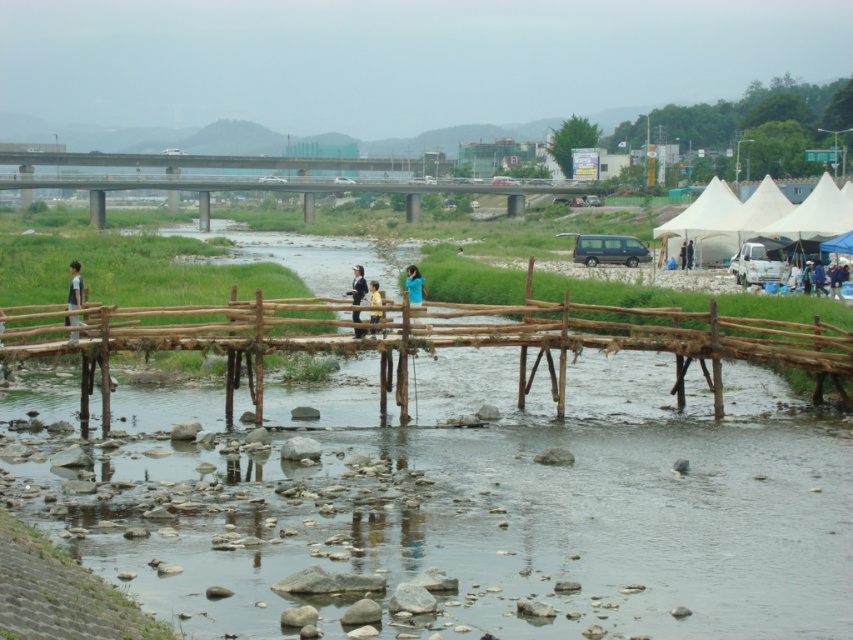
Question: Which of these objects is positioned farthest from the natural wood bridge at center?

Choices:
 (A) yellow shirt at center
 (B) wooden fence at center
 (C) light blue fabric jacket at center
 (D) blue fabric at center

Answer: (B)

Question: Which point is farther to the camera?

Choices:
 (A) blue fabric at center
 (B) light blue fabric jacket at center

Answer: (A)

Question: Can you confirm if light blue shirt at left is positioned above light blue fabric jacket at center?

Choices:
 (A) no
 (B) yes

Answer: (B)

Question: Which point appears farthest from the camera in this image?

Choices:
 (A) (184, 342)
 (B) (380, 294)
 (C) (70, 333)

Answer: (B)

Question: Can you confirm if natural wood bridge at center is positioned above blue fabric at center?

Choices:
 (A) no
 (B) yes

Answer: (A)

Question: Where is light blue shirt at left located in relation to yellow shirt at center in the image?

Choices:
 (A) below
 (B) above

Answer: (B)